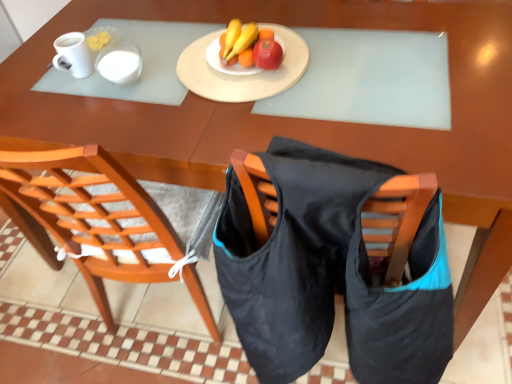
The image size is (512, 384). I want to click on vacant space in between matte white plate at center and white glossy mug at upper left, so click(x=163, y=59).